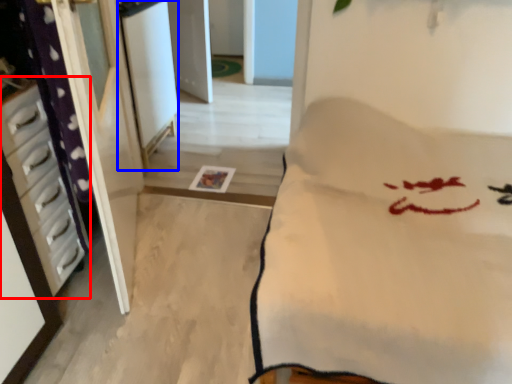
Question: Which point is closer to the camera, furniture (highlighted by a red box) or screen door (highlighted by a blue box)?

Choices:
 (A) furniture
 (B) screen door

Answer: (A)